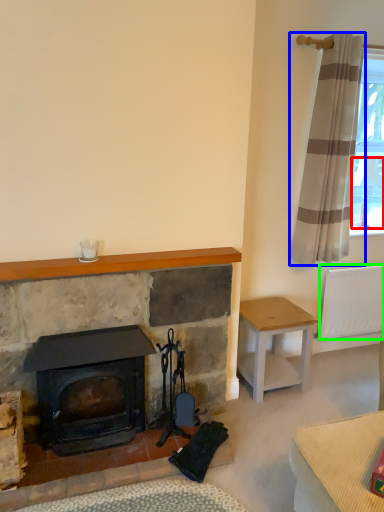
Question: Based on their relative distances, which object is farther from lamp (highlighted by a red box)? Choose from curtain (highlighted by a blue box) and radiator (highlighted by a green box).

Choices:
 (A) curtain
 (B) radiator

Answer: (B)